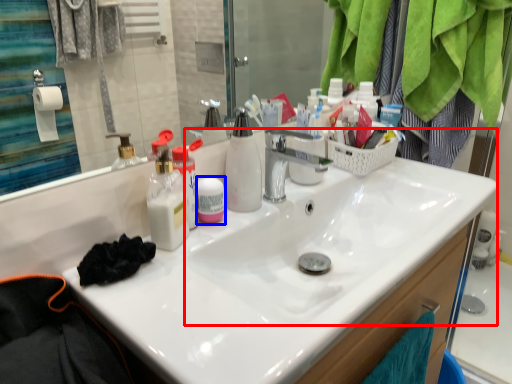
Question: Which object appears closest to the camera in this image, sink (highlighted by a red box) or toiletries (highlighted by a blue box)?

Choices:
 (A) sink
 (B) toiletries

Answer: (A)